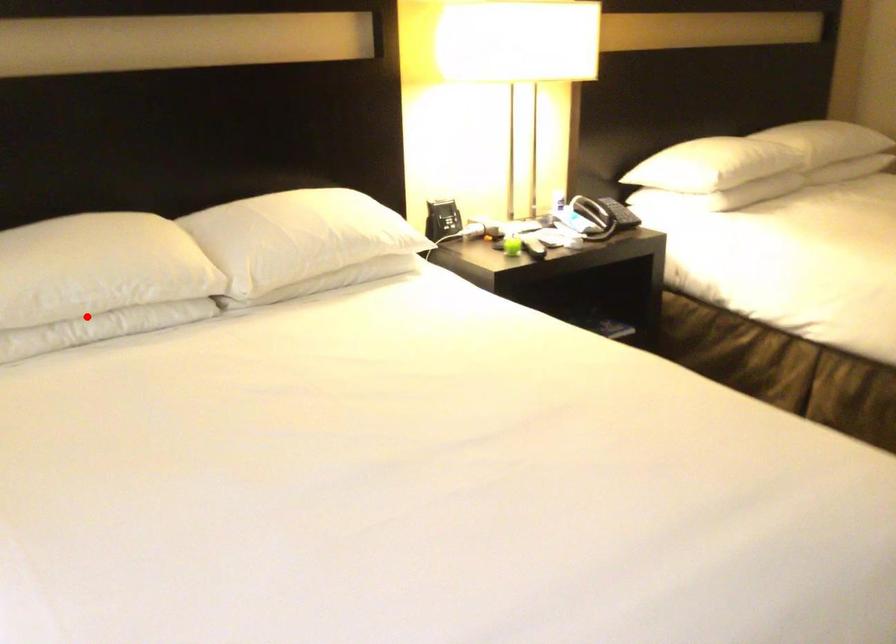
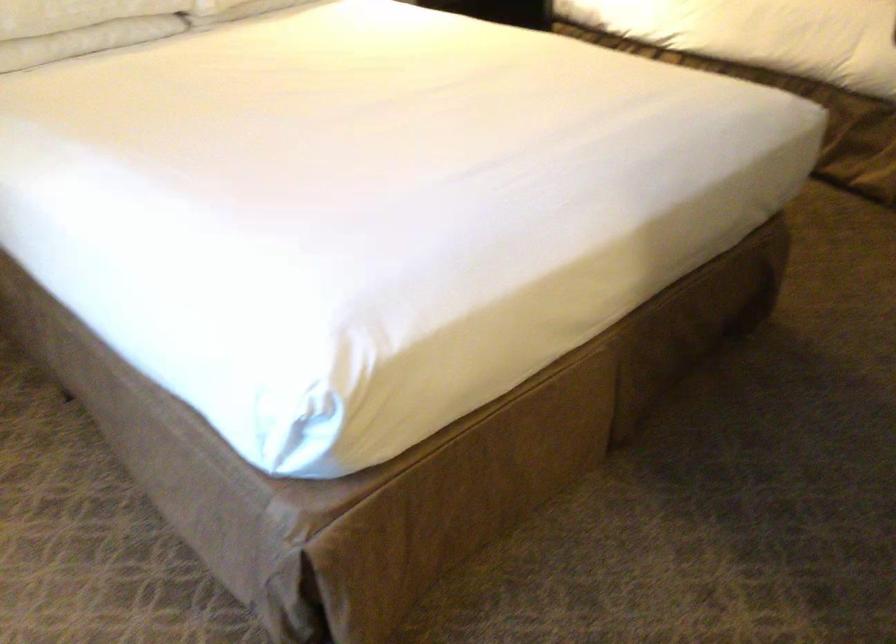
Locate, in the second image, the point that corresponds to the highlighted location in the first image.

(81, 26)